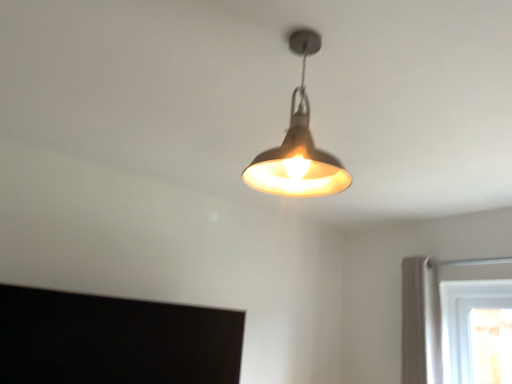
Question: Is matte silver lampshade at center to the right of white fabric curtain at right from the viewer's perspective?

Choices:
 (A) no
 (B) yes

Answer: (A)

Question: Is matte silver lampshade at center taller than white fabric curtain at right?

Choices:
 (A) no
 (B) yes

Answer: (A)

Question: Is matte silver lampshade at center not close to white fabric curtain at right?

Choices:
 (A) no
 (B) yes

Answer: (B)

Question: Does matte silver lampshade at center come behind white fabric curtain at right?

Choices:
 (A) no
 (B) yes

Answer: (A)

Question: Can you confirm if matte silver lampshade at center is bigger than white fabric curtain at right?

Choices:
 (A) no
 (B) yes

Answer: (A)

Question: Can you confirm if matte silver lampshade at center is thinner than white fabric curtain at right?

Choices:
 (A) no
 (B) yes

Answer: (A)

Question: Is matte silver lampshade at center a part of white fabric curtain at right?

Choices:
 (A) yes
 (B) no

Answer: (B)

Question: Could you tell me if white fabric curtain at right is turned towards matte silver lampshade at center?

Choices:
 (A) yes
 (B) no

Answer: (B)

Question: From the image's perspective, would you say white fabric curtain at right is positioned over matte silver lampshade at center?

Choices:
 (A) no
 (B) yes

Answer: (A)

Question: Is white fabric curtain at right directly adjacent to matte silver lampshade at center?

Choices:
 (A) yes
 (B) no

Answer: (B)

Question: Considering the relative sizes of white fabric curtain at right and matte silver lampshade at center in the image provided, is white fabric curtain at right wider than matte silver lampshade at center?

Choices:
 (A) no
 (B) yes

Answer: (A)

Question: Is white fabric curtain at right smaller than matte silver lampshade at center?

Choices:
 (A) yes
 (B) no

Answer: (B)

Question: Is point [417, 297] positioned closer to the camera than point [281, 173]?

Choices:
 (A) farther
 (B) closer

Answer: (A)